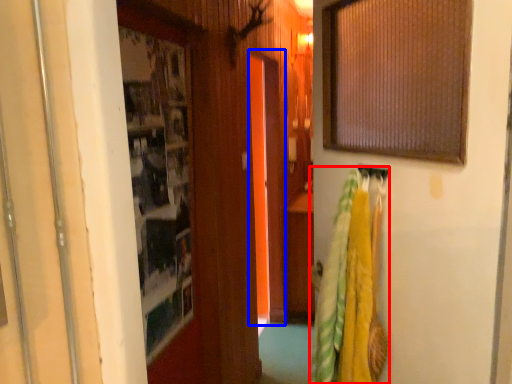
Question: Which object is further to the camera taking this photo, laundry (highlighted by a red box) or screen door (highlighted by a blue box)?

Choices:
 (A) laundry
 (B) screen door

Answer: (B)